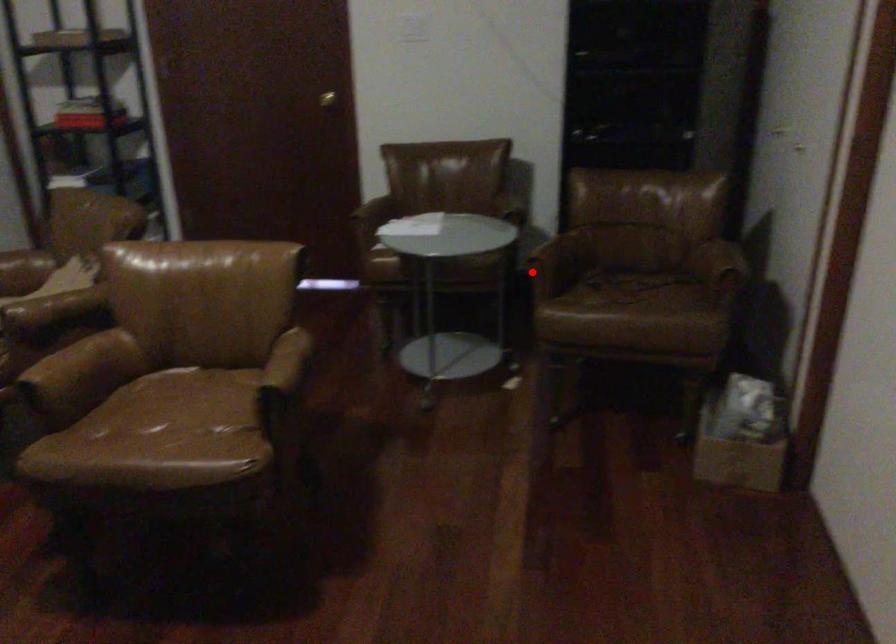
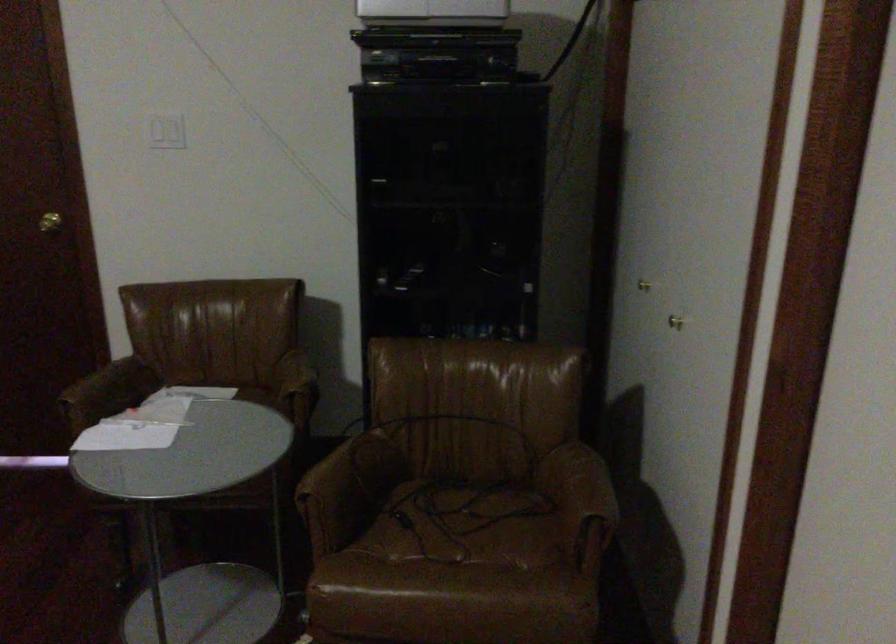
Locate, in the second image, the point that corresponds to the highlighted location in the first image.

(312, 513)